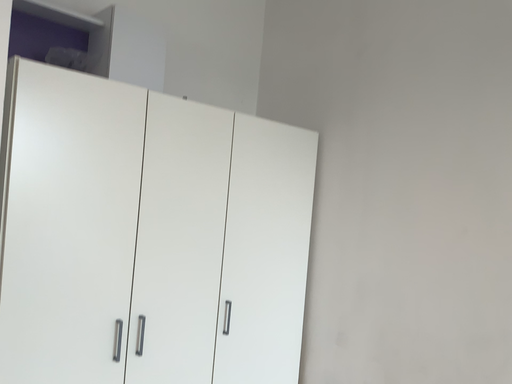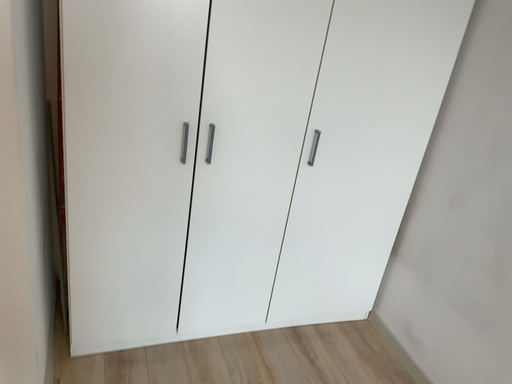
Question: How did the camera likely rotate when shooting the video?

Choices:
 (A) rotated upward
 (B) rotated downward

Answer: (B)